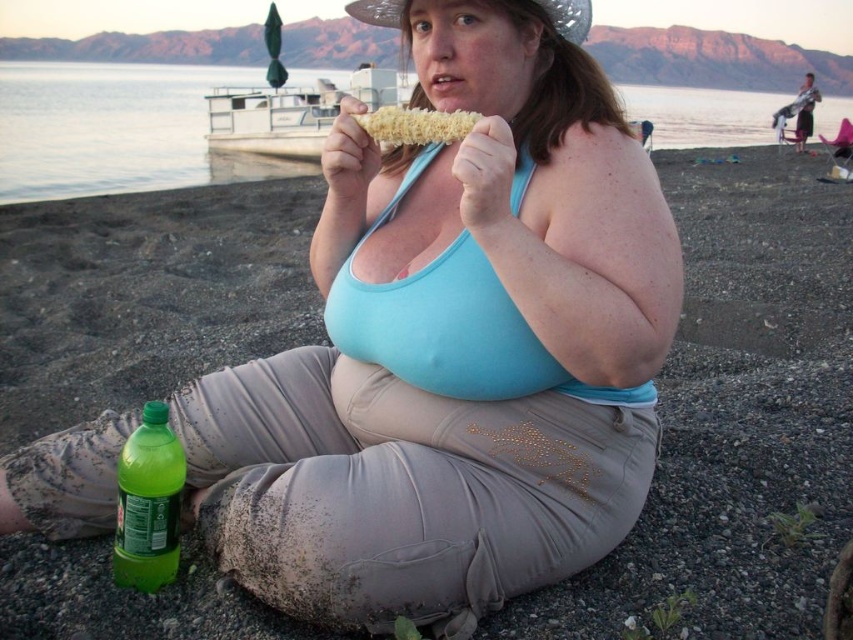
Based on the photo, is clear water at center closer to the viewer compared to green plastic bottle at lower left?

That is False.

Is clear water at center thinner than green plastic bottle at lower left?

No, clear water at center is not thinner than green plastic bottle at lower left.

This screenshot has height=640, width=853. I want to click on clear water at center, so click(x=114, y=129).

Is green plastic bottle at lower left positioned in front of golden corn at center?

No.

The image size is (853, 640). Describe the element at coordinates (148, 502) in the screenshot. I see `green plastic bottle at lower left` at that location.

Locate an element on the screen. green plastic bottle at lower left is located at coordinates (148, 502).

You are a GUI agent. You are given a task and a screenshot of the screen. Output one action in this format:
    pyautogui.click(x=<x>, y=<y>)
    Task: Click on the clear water at center
    
    Given the screenshot: What is the action you would take?
    pyautogui.click(x=114, y=129)

Can you confirm if clear water at center is positioned above golden corn at center?

Indeed, clear water at center is positioned over golden corn at center.

Which is behind, point (10, 93) or point (399, 113)?

The point (10, 93) is more distant.

Identify the location of clear water at center. (114, 129).